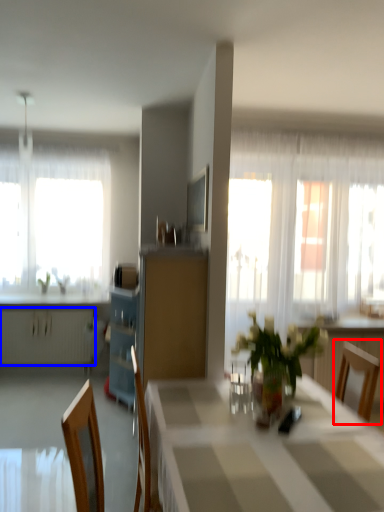
Question: Which object is closer to the camera taking this photo, chair (highlighted by a red box) or radiator (highlighted by a blue box)?

Choices:
 (A) chair
 (B) radiator

Answer: (A)